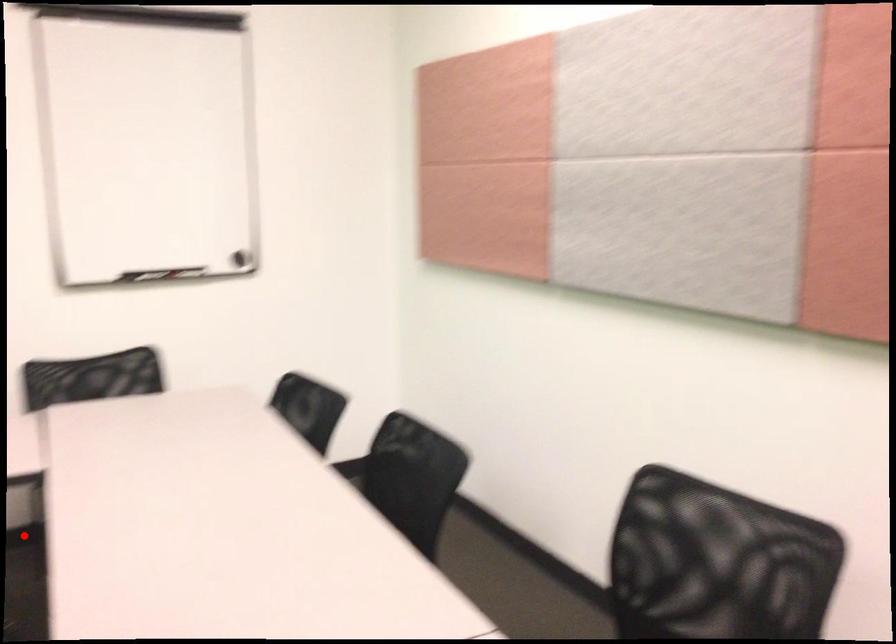
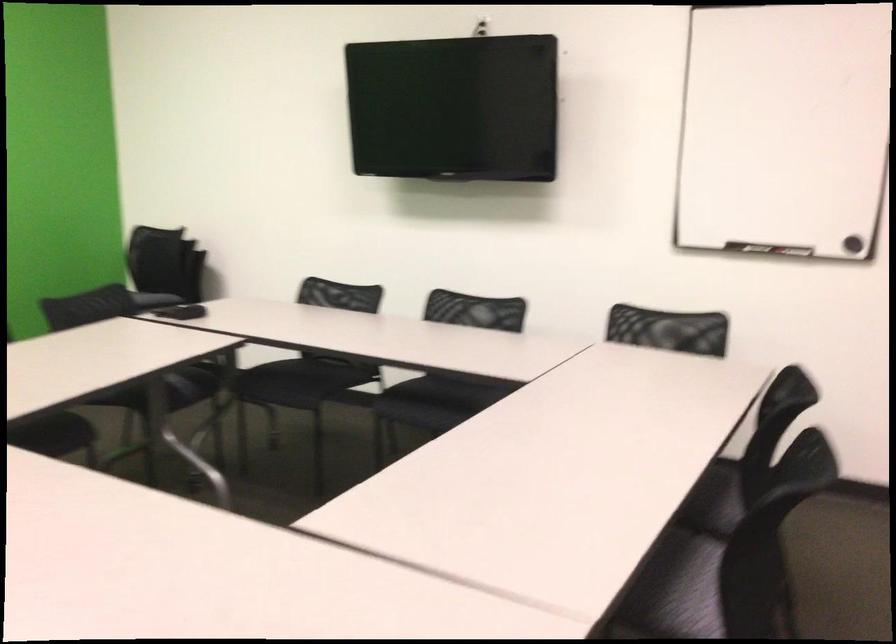
Question: I am providing you with two images of the same scene from different viewpoints. A red point is marked on the first image. Is the red point's position out of view in image 2?

Choices:
 (A) Yes
 (B) No

Answer: (A)